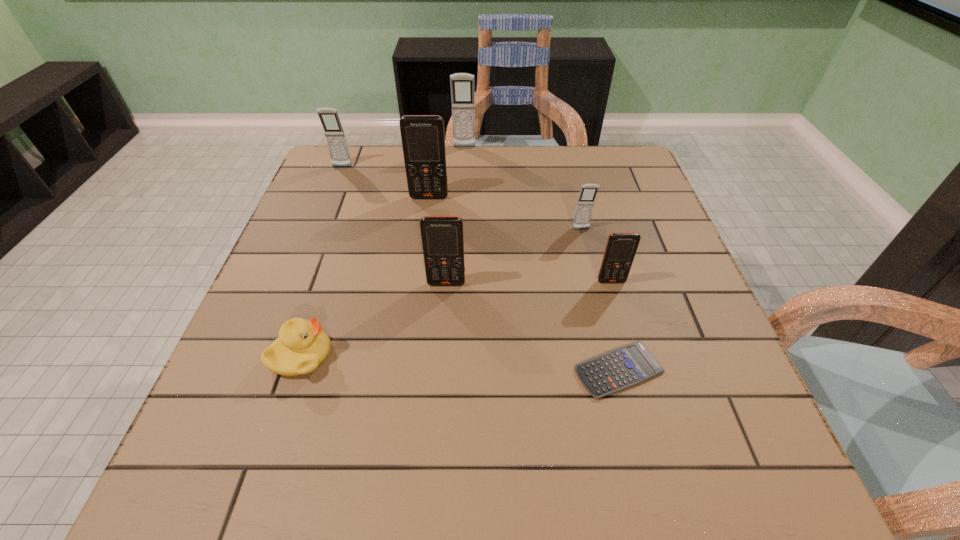
The image size is (960, 540). Find the location of `the farthest gray cellular telephone`. the farthest gray cellular telephone is located at coordinates (462, 84).

This screenshot has height=540, width=960. Find the location of `the farthest object`. the farthest object is located at coordinates (462, 84).

What are the coordinates of `the sixth nearest object` in the screenshot? It's located at (423, 140).

Where is `the farthest orange cellular telephone`? the farthest orange cellular telephone is located at coordinates (423, 140).

The width and height of the screenshot is (960, 540). I want to click on the leftmost cellular telephone, so click(x=334, y=133).

Locate an element on the screen. the leftmost gray cellular telephone is located at coordinates (334, 133).

Where is `the second smallest orange cellular telephone`? The image size is (960, 540). the second smallest orange cellular telephone is located at coordinates (442, 237).

Identify the location of the smallest orange cellular telephone. The height and width of the screenshot is (540, 960). (621, 247).

Find the location of a particular element. the fourth farthest cellular telephone is located at coordinates (588, 192).

Identify the location of the nearest gray cellular telephone. (588, 192).